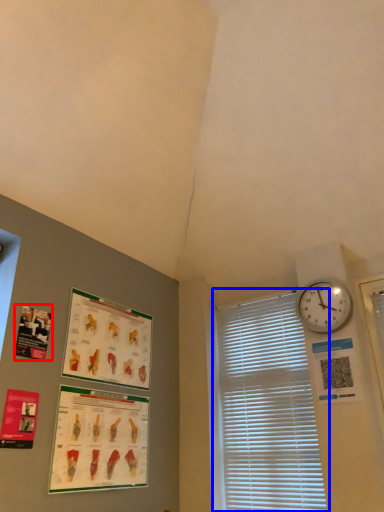
Question: Among these objects, which one is farthest to the camera, poster page (highlighted by a red box) or window blind (highlighted by a blue box)?

Choices:
 (A) poster page
 (B) window blind

Answer: (B)